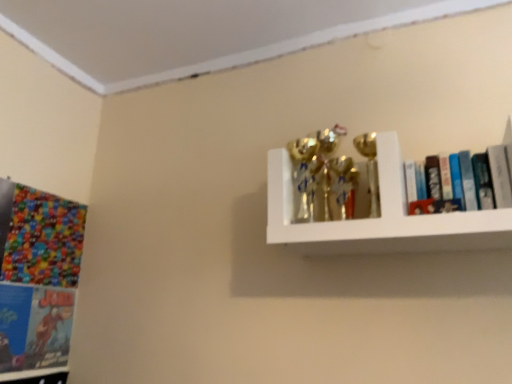
The image size is (512, 384). In order to click on white glossy shelf at upper right in this screenshot , I will do `click(379, 217)`.

What do you see at coordinates (35, 333) in the screenshot?
I see `matte blue book at lower left, which is the second book from right to left` at bounding box center [35, 333].

Where is `white glossy shelf at upper right`? white glossy shelf at upper right is located at coordinates (379, 217).

Considering the sizes of objects matte blue book at lower left, acting as the 2th book starting from the top, and multicolored glossy comic book at left in the image provided, who is shorter, matte blue book at lower left, acting as the 2th book starting from the top, or multicolored glossy comic book at left?

With less height is matte blue book at lower left, acting as the 2th book starting from the top.

Is matte blue book at lower left, the 1th book from the bottom, situated inside multicolored glossy comic book at left or outside?

matte blue book at lower left, the 1th book from the bottom, cannot be found inside multicolored glossy comic book at left.

Can you tell me how much matte blue book at lower left, acting as the 2th book starting from the top, and multicolored glossy comic book at left differ in facing direction?

matte blue book at lower left, acting as the 2th book starting from the top, and multicolored glossy comic book at left are facing 0.00167 degrees away from each other.

From the image's perspective, who appears lower, matte blue book at lower left, which is the second book from right to left, or multicolored glossy comic book at left?

matte blue book at lower left, which is the second book from right to left, is shown below in the image.

Is point (454, 199) in front of point (13, 341)?

Yes, point (454, 199) is in front of point (13, 341).

Are hardcover books at upper right, acting as the 2th book starting from the left, and matte blue book at lower left, the 1th book viewed from the left, located far from each other?

hardcover books at upper right, acting as the 2th book starting from the left, is positioned a significant distance from matte blue book at lower left, the 1th book viewed from the left.

What's the angular difference between hardcover books at upper right, which is the first book in top-to-bottom order, and matte blue book at lower left, placed as the second book when sorted from front to back,'s facing directions?

They differ by 92.5 degrees in their facing directions.

Consider the image. Is hardcover books at upper right, which is the first book in top-to-bottom order, facing away from multicolored glossy comic book at left?

hardcover books at upper right, which is the first book in top-to-bottom order, is not turned away from multicolored glossy comic book at left.

Is hardcover books at upper right, which is counted as the 2th book, starting from the bottom, behind multicolored glossy comic book at left?

No, the depth of hardcover books at upper right, which is counted as the 2th book, starting from the bottom, is less than that of multicolored glossy comic book at left.

Is hardcover books at upper right, the 1th book when ordered from front to back, taller or shorter than multicolored glossy comic book at left?

In the image, hardcover books at upper right, the 1th book when ordered from front to back, appears to be shorter than multicolored glossy comic book at left.

Is matte blue book at lower left, the 1th book from the bottom, thinner than white glossy shelf at upper right?

Indeed, matte blue book at lower left, the 1th book from the bottom, has a lesser width compared to white glossy shelf at upper right.

Is matte blue book at lower left, placed as the second book when sorted from front to back, not inside white glossy shelf at upper right?

Yes.

Could you measure the distance between matte blue book at lower left, which is the second book from right to left, and white glossy shelf at upper right?

1.11 meters.

Which is behind, point (458, 246) or point (51, 333)?

The point (51, 333) is more distant.

Is white glossy shelf at upper right positioned far away from matte blue book at lower left, placed as the second book when sorted from front to back?

white glossy shelf at upper right is far away from matte blue book at lower left, placed as the second book when sorted from front to back.

From the image's perspective, is white glossy shelf at upper right over matte blue book at lower left, placed as the 1th book when sorted from back to front?

Yes, from the image's perspective, white glossy shelf at upper right is above matte blue book at lower left, placed as the 1th book when sorted from back to front.

In the image, is white glossy shelf at upper right positioned in front of or behind matte blue book at lower left, placed as the 1th book when sorted from back to front?

white glossy shelf at upper right is positioned closer to the viewer than matte blue book at lower left, placed as the 1th book when sorted from back to front.

From the image's perspective, between multicolored glossy comic book at left and white glossy shelf at upper right, which one is located above?

white glossy shelf at upper right is shown above in the image.

The height and width of the screenshot is (384, 512). I want to click on comic book to the left of white glossy shelf at upper right, so click(37, 281).

From a real-world perspective, is multicolored glossy comic book at left positioned above or below white glossy shelf at upper right?

In terms of real-world spatial position, multicolored glossy comic book at left is below white glossy shelf at upper right.

Could you tell me if multicolored glossy comic book at left is facing white glossy shelf at upper right?

Yes, multicolored glossy comic book at left is oriented towards white glossy shelf at upper right.

Considering the relative sizes of hardcover books at upper right, arranged as the first book when viewed from the right, and white glossy shelf at upper right in the image provided, is hardcover books at upper right, arranged as the first book when viewed from the right, shorter than white glossy shelf at upper right?

Indeed, hardcover books at upper right, arranged as the first book when viewed from the right, has a lesser height compared to white glossy shelf at upper right.

Considering the sizes of hardcover books at upper right, arranged as the first book when viewed from the right, and white glossy shelf at upper right in the image, is hardcover books at upper right, arranged as the first book when viewed from the right, wider or thinner than white glossy shelf at upper right?

In the image, hardcover books at upper right, arranged as the first book when viewed from the right, appears to be more narrow than white glossy shelf at upper right.

How different are the orientations of hardcover books at upper right, acting as the 2th book starting from the left, and white glossy shelf at upper right in degrees?

They differ by 0.907 degrees in their facing directions.

Measure the distance between hardcover books at upper right, which appears as the 2th book when viewed from the back, and white glossy shelf at upper right.

hardcover books at upper right, which appears as the 2th book when viewed from the back, is 7.32 inches away from white glossy shelf at upper right.

What are the coordinates of `comic book above the matte blue book at lower left, which is the second book from right to left (from the image's perspective)` in the screenshot? It's located at (37, 281).

In order to click on book below the hardcover books at upper right, arranged as the first book when viewed from the right (from the image's perspective) in this screenshot , I will do `click(35, 333)`.

Which object lies further to the anchor point white glossy shelf at upper right, multicolored glossy comic book at left or matte blue book at lower left, the 1th book from the bottom?

matte blue book at lower left, the 1th book from the bottom, is further to white glossy shelf at upper right.

From the picture: Considering their positions, is white glossy shelf at upper right positioned closer to matte blue book at lower left, the 1th book from the bottom, than hardcover books at upper right, which appears as the 2th book when viewed from the back?

white glossy shelf at upper right.

Estimate the real-world distances between objects in this image. Which object is closer to hardcover books at upper right, which is the first book in top-to-bottom order, multicolored glossy comic book at left or white glossy shelf at upper right?

white glossy shelf at upper right is positioned closer to the anchor hardcover books at upper right, which is the first book in top-to-bottom order.

Considering their positions, is matte blue book at lower left, placed as the 1th book when sorted from back to front, positioned closer to white glossy shelf at upper right than hardcover books at upper right, which is counted as the 2th book, starting from the bottom?

hardcover books at upper right, which is counted as the 2th book, starting from the bottom, lies closer to white glossy shelf at upper right than the other object.

Estimate the real-world distances between objects in this image. Which object is closer to hardcover books at upper right, which is counted as the 2th book, starting from the bottom, matte blue book at lower left, placed as the 1th book when sorted from back to front, or white glossy shelf at upper right?

The object closer to hardcover books at upper right, which is counted as the 2th book, starting from the bottom, is white glossy shelf at upper right.

From the image, which object appears to be farther from matte blue book at lower left, the 1th book from the bottom, hardcover books at upper right, which is the first book in top-to-bottom order, or white glossy shelf at upper right?

Among the two, hardcover books at upper right, which is the first book in top-to-bottom order, is located further to matte blue book at lower left, the 1th book from the bottom.

From the picture: When comparing their distances from matte blue book at lower left, acting as the 2th book starting from the top, does hardcover books at upper right, the 1th book when ordered from front to back, or multicolored glossy comic book at left seem further?

hardcover books at upper right, the 1th book when ordered from front to back, lies further to matte blue book at lower left, acting as the 2th book starting from the top, than the other object.

Which object lies further to the anchor point hardcover books at upper right, acting as the 2th book starting from the left, matte blue book at lower left, acting as the 2th book starting from the top, or multicolored glossy comic book at left?

Based on the image, matte blue book at lower left, acting as the 2th book starting from the top, appears to be further to hardcover books at upper right, acting as the 2th book starting from the left.

Find the location of a particular element. This screenshot has height=384, width=512. comic book between matte blue book at lower left, acting as the 2th book starting from the top, and hardcover books at upper right, which appears as the 2th book when viewed from the back, from left to right is located at coordinates (37, 281).

At what (x,y) coordinates should I click in order to perform the action: click on shelf between multicolored glossy comic book at left and hardcover books at upper right, which appears as the 2th book when viewed from the back, in the horizontal direction. Please return your answer as a coordinate pair (x, y). Looking at the image, I should click on (379, 217).

Locate an element on the screen. The width and height of the screenshot is (512, 384). shelf between matte blue book at lower left, which is the second book from right to left, and hardcover books at upper right, which is counted as the 2th book, starting from the bottom, in the horizontal direction is located at coordinates (379, 217).

At what (x,y) coordinates should I click in order to perform the action: click on comic book between matte blue book at lower left, the 1th book from the bottom, and white glossy shelf at upper right, in the horizontal direction. Please return your answer as a coordinate pair (x, y). This screenshot has width=512, height=384. Looking at the image, I should click on (37, 281).